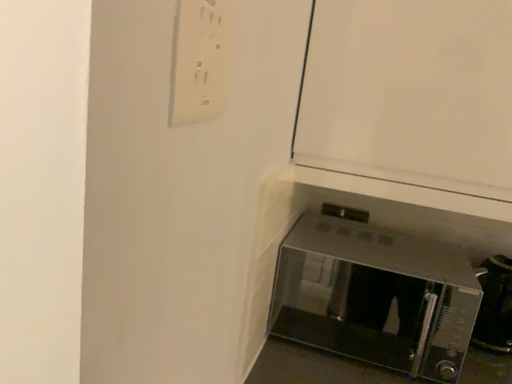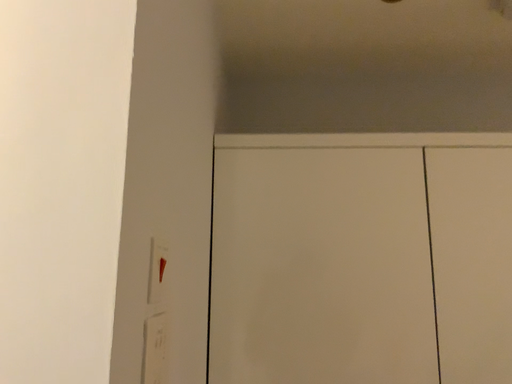
Question: Which way did the camera rotate in the video?

Choices:
 (A) rotated right
 (B) rotated left

Answer: (A)